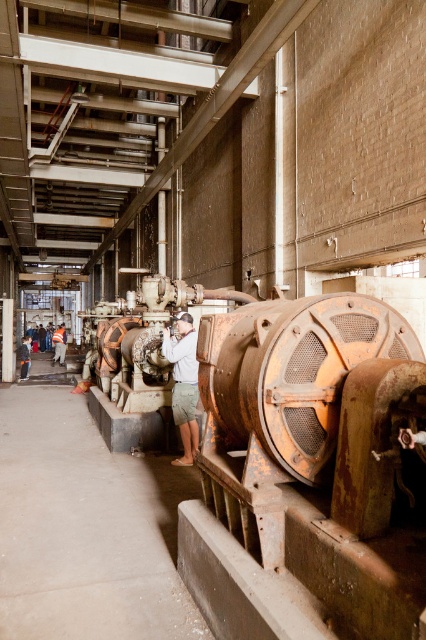
Does light brown fabric shorts at center have a lesser height compared to light brown leather jacket at lower left?

No, light brown fabric shorts at center is not shorter than light brown leather jacket at lower left.

Where is `light brown fabric shorts at center`? This screenshot has height=640, width=426. light brown fabric shorts at center is located at coordinates (184, 385).

Can you confirm if orange reflective vest at center is taller than light brown leather jacket at lower left?

Yes.

Is the position of orange reflective vest at center less distant than that of light brown leather jacket at lower left?

That is False.

The height and width of the screenshot is (640, 426). I want to click on orange reflective vest at center, so click(x=58, y=342).

This screenshot has height=640, width=426. I want to click on orange reflective vest at center, so click(x=58, y=342).

Measure the distance between light brown fabric shorts at center and orange reflective vest at center.

14.66 meters

The image size is (426, 640). Describe the element at coordinates (184, 385) in the screenshot. I see `light brown fabric shorts at center` at that location.

Locate an element on the screen. Image resolution: width=426 pixels, height=640 pixels. light brown fabric shorts at center is located at coordinates (184, 385).

Find the location of a particular element. light brown fabric shorts at center is located at coordinates (184, 385).